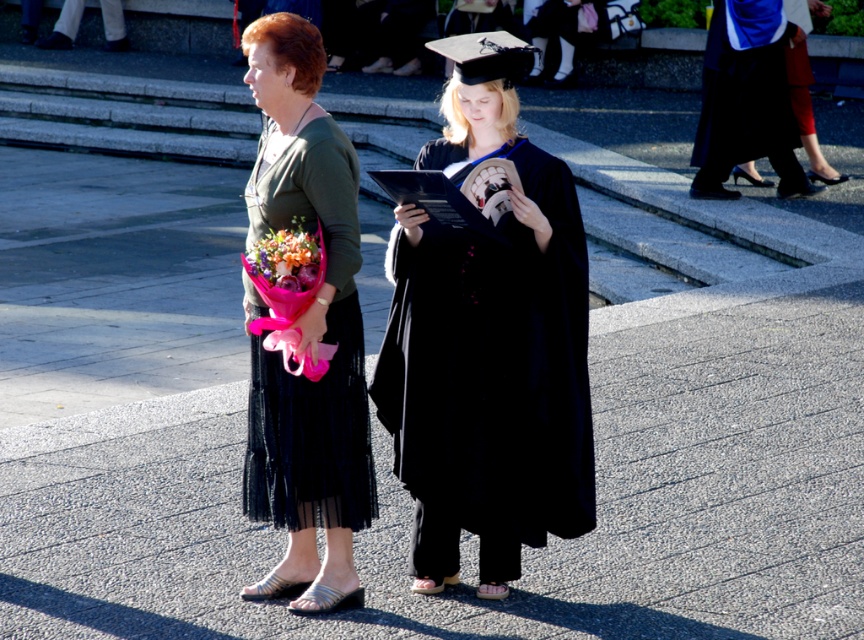
Does matte black graduation gown at center have a greater width compared to matte green dress at center?

Indeed, matte black graduation gown at center has a greater width compared to matte green dress at center.

Consider the image. Does matte black graduation gown at center lie in front of matte green dress at center?

Yes, matte black graduation gown at center is in front of matte green dress at center.

Which is in front, point (405, 426) or point (264, 304)?

Positioned in front is point (405, 426).

The width and height of the screenshot is (864, 640). Identify the location of matte black graduation gown at center. (488, 340).

Does matte black graduation gown at center have a lesser width compared to blue satin robe at upper right?

Indeed, matte black graduation gown at center has a lesser width compared to blue satin robe at upper right.

Who is taller, matte black graduation gown at center or blue satin robe at upper right?

With more height is matte black graduation gown at center.

Image resolution: width=864 pixels, height=640 pixels. Find the location of `matte black graduation gown at center`. matte black graduation gown at center is located at coordinates (488, 340).

Who is taller, matte green dress at center or blue satin robe at upper right?

With more height is matte green dress at center.

Is the position of matte green dress at center more distant than that of blue satin robe at upper right?

No, matte green dress at center is in front of blue satin robe at upper right.

The height and width of the screenshot is (640, 864). Describe the element at coordinates (306, 332) in the screenshot. I see `matte green dress at center` at that location.

You are a GUI agent. You are given a task and a screenshot of the screen. Output one action in this format:
    pyautogui.click(x=<x>, y=<y>)
    Task: Click on the matte green dress at center
    The image size is (864, 640).
    Given the screenshot: What is the action you would take?
    pyautogui.click(x=306, y=332)